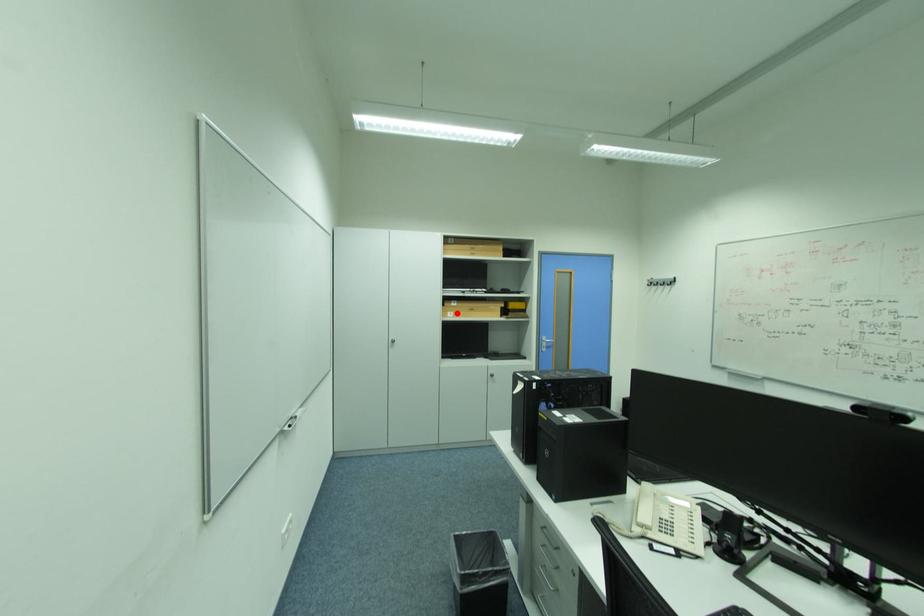
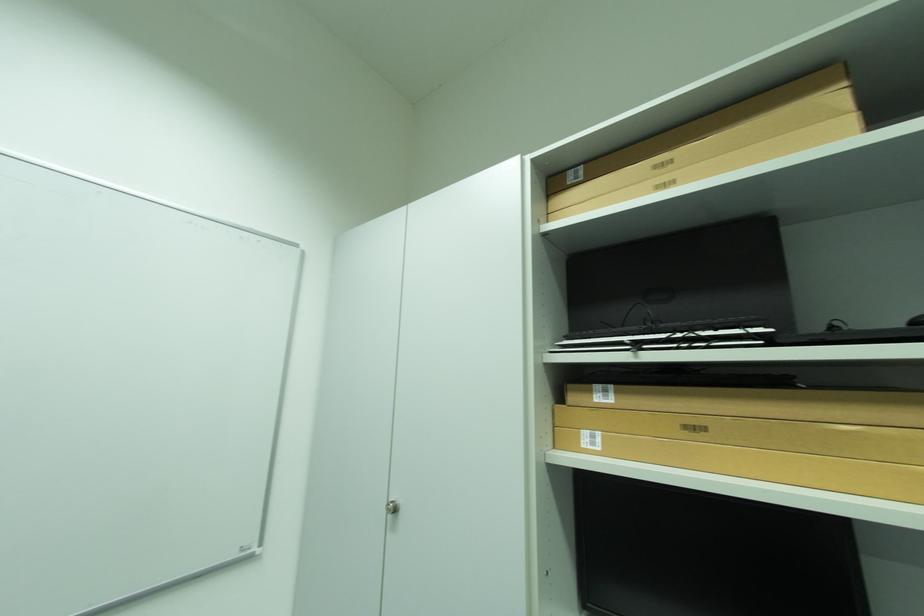
Locate, in the second image, the point that corresponds to the highlighted location in the first image.

(593, 434)